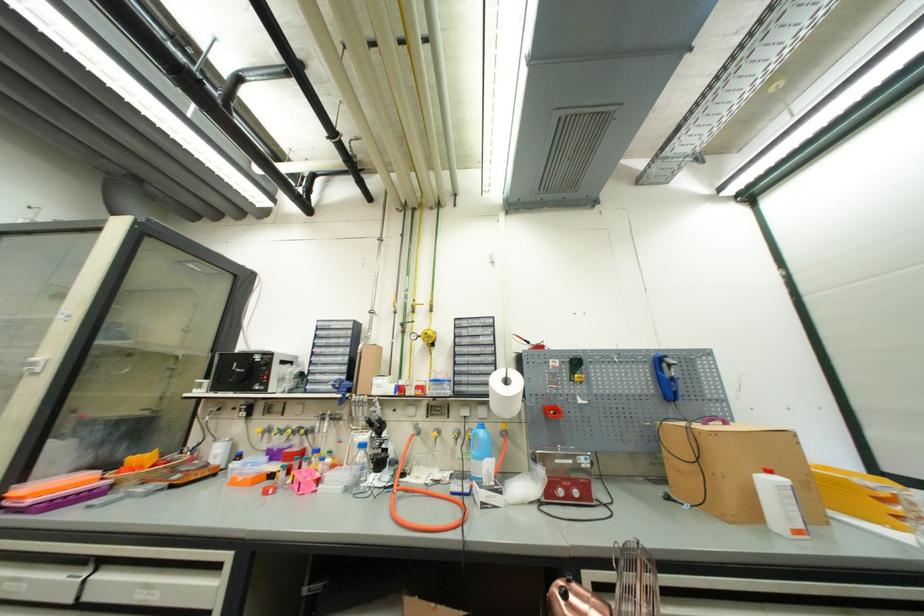
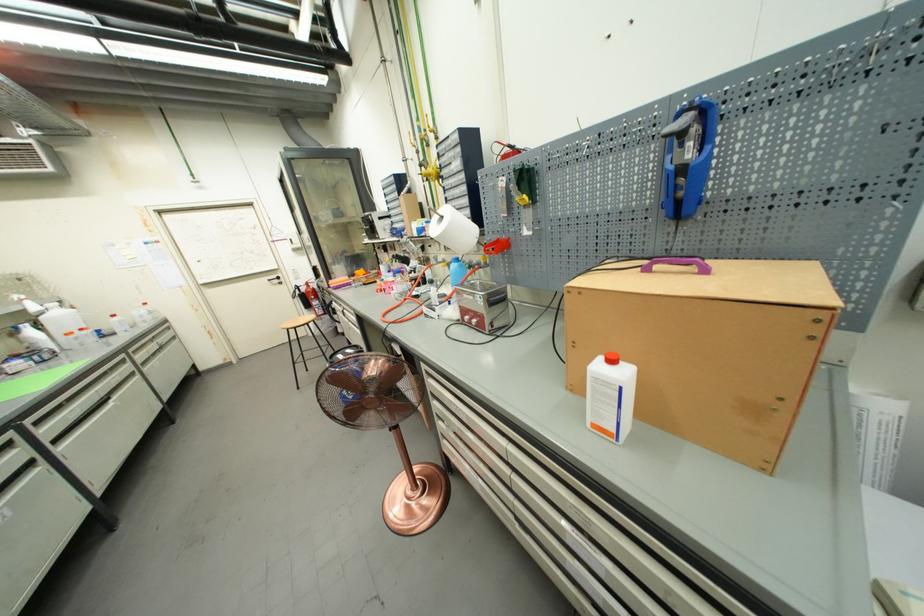
The point at (775, 474) is marked in the first image. Where is the corresponding point in the second image?

(617, 363)